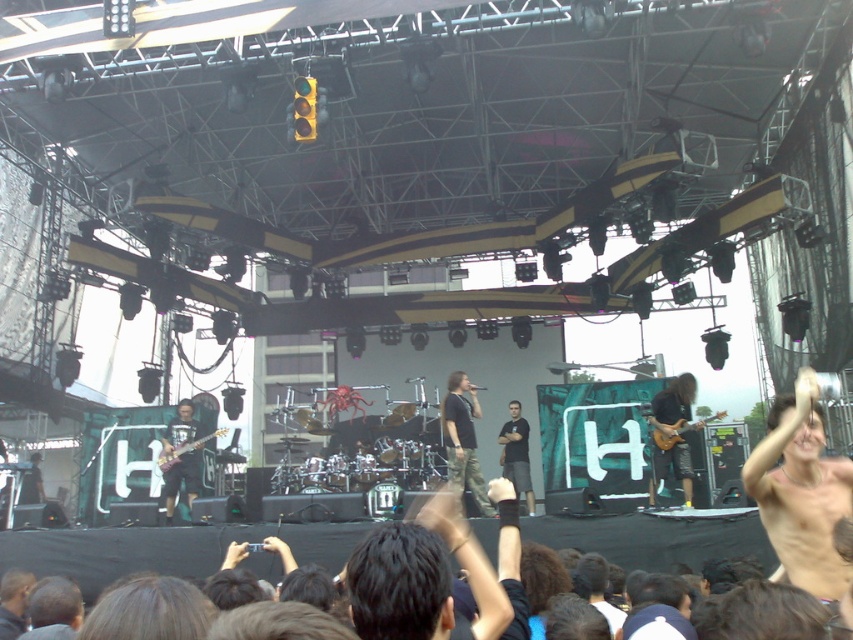
You are a photographer at the concert and want to take a closeup shot of the musician wearing both the camouflage pants at center and the black cotton shirt at center. Which piece of clothing will appear larger in your photo?

The camouflage pants at center will appear larger in the photo because it is closer to the viewer than the black cotton shirt at center.

You are a photographer standing at the edge of the concert venue. You want to capture a closeup shot of the camouflage pants at center. Considering your current position, do you think the distance is suitable for a clear closeup without moving closer?

The camouflage pants at center are 37.19 meters away from the viewer. This distance may be too far for a clear closeup shot without using a telephoto lens or moving closer.